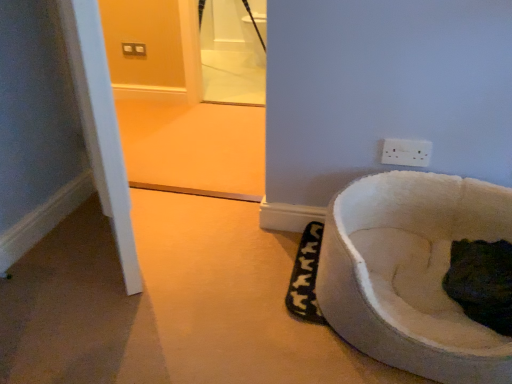
Question: From a real-world perspective, is white soft pet bed at lower right physically below white plastic power plugs and sockets at upper right?

Choices:
 (A) no
 (B) yes

Answer: (B)

Question: Does white soft pet bed at lower right appear on the right side of white plastic power plugs and sockets at upper right?

Choices:
 (A) no
 (B) yes

Answer: (B)

Question: Is white soft pet bed at lower right located outside white plastic power plugs and sockets at upper right?

Choices:
 (A) no
 (B) yes

Answer: (B)

Question: From a real-world perspective, is white soft pet bed at lower right on top of white plastic power plugs and sockets at upper right?

Choices:
 (A) no
 (B) yes

Answer: (A)

Question: Is white soft pet bed at lower right positioned behind white plastic power plugs and sockets at upper right?

Choices:
 (A) no
 (B) yes

Answer: (A)

Question: Is white plastic power plugs and sockets at upper right inside or outside of white soft pet bed at lower right?

Choices:
 (A) outside
 (B) inside

Answer: (A)

Question: Visually, is white plastic power plugs and sockets at upper right positioned to the left or to the right of white soft pet bed at lower right?

Choices:
 (A) right
 (B) left

Answer: (B)

Question: Considering the positions of white plastic power plugs and sockets at upper right and white soft pet bed at lower right in the image, is white plastic power plugs and sockets at upper right bigger or smaller than white soft pet bed at lower right?

Choices:
 (A) small
 (B) big

Answer: (A)

Question: From a real-world perspective, is white plastic power plugs and sockets at upper right above or below white soft pet bed at lower right?

Choices:
 (A) below
 (B) above

Answer: (B)

Question: Looking at the image, does white soft pet bed at lower right seem bigger or smaller compared to dark fur cat at lower right?

Choices:
 (A) small
 (B) big

Answer: (B)

Question: Is point (320, 289) closer or farther from the camera than point (497, 324)?

Choices:
 (A) farther
 (B) closer

Answer: (A)

Question: Considering their positions, is white soft pet bed at lower right located in front of or behind dark fur cat at lower right?

Choices:
 (A) front
 (B) behind

Answer: (A)

Question: From the image's perspective, is white soft pet bed at lower right located above or below dark fur cat at lower right?

Choices:
 (A) above
 (B) below

Answer: (A)

Question: In terms of height, does dark fur cat at lower right look taller or shorter compared to white plastic power plugs and sockets at upper right?

Choices:
 (A) short
 (B) tall

Answer: (B)

Question: From the image's perspective, relative to white plastic power plugs and sockets at upper right, is dark fur cat at lower right above or below?

Choices:
 (A) below
 (B) above

Answer: (A)